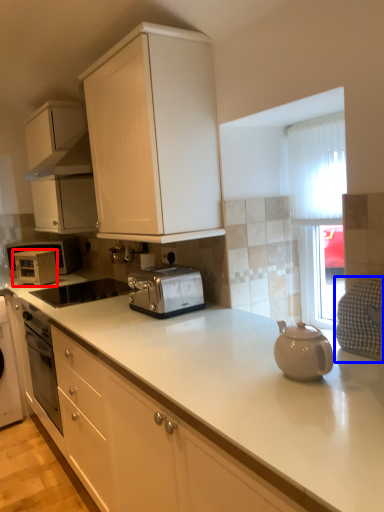
Question: Which of the following is the farthest to the observer, appliance (highlighted by a red box) or gray (highlighted by a blue box)?

Choices:
 (A) appliance
 (B) gray

Answer: (A)